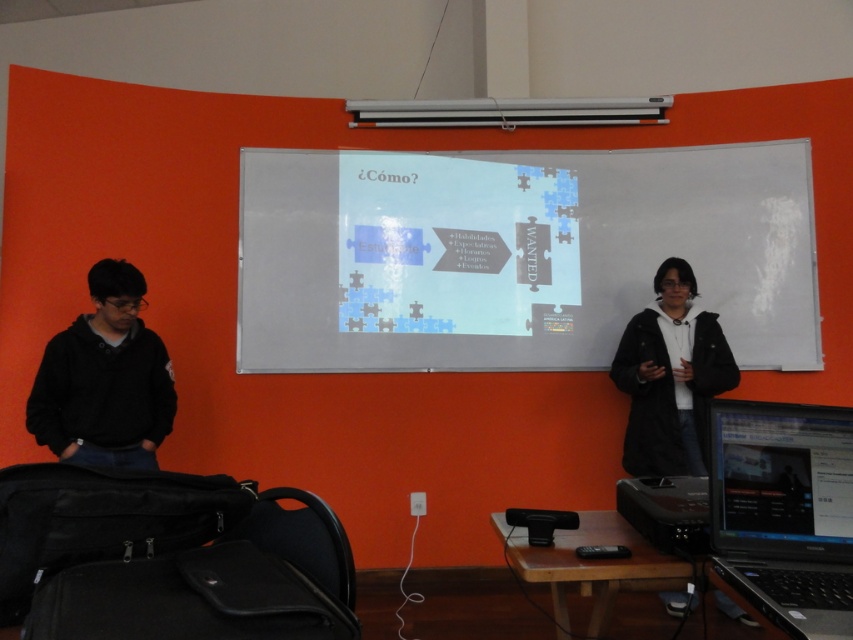
Question: Can you confirm if silver metallic laptop at lower right is bigger than black hoodie at left?

Choices:
 (A) no
 (B) yes

Answer: (A)

Question: In this image, where is black hoodie at left located relative to black matte jacket at right?

Choices:
 (A) below
 (B) above

Answer: (B)

Question: Among these points, which one is nearest to the camera?

Choices:
 (A) (663, 272)
 (B) (492, 163)
 (C) (143, 444)
 (D) (801, 461)

Answer: (D)

Question: Which point is closer to the camera taking this photo?

Choices:
 (A) (636, 456)
 (B) (599, 323)
 (C) (88, 404)
 (D) (838, 536)

Answer: (D)

Question: Which of these objects is positioned closest to the white matte projection screen at center?

Choices:
 (A) silver metallic laptop at lower right
 (B) black hoodie at left

Answer: (B)

Question: Can you confirm if white matte projection screen at center is wider than silver metallic laptop at lower right?

Choices:
 (A) yes
 (B) no

Answer: (A)